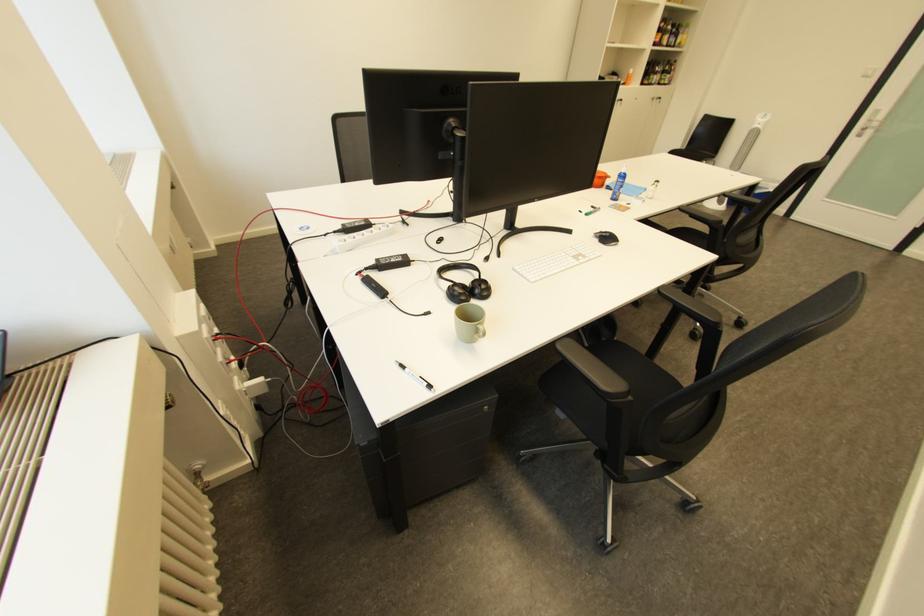
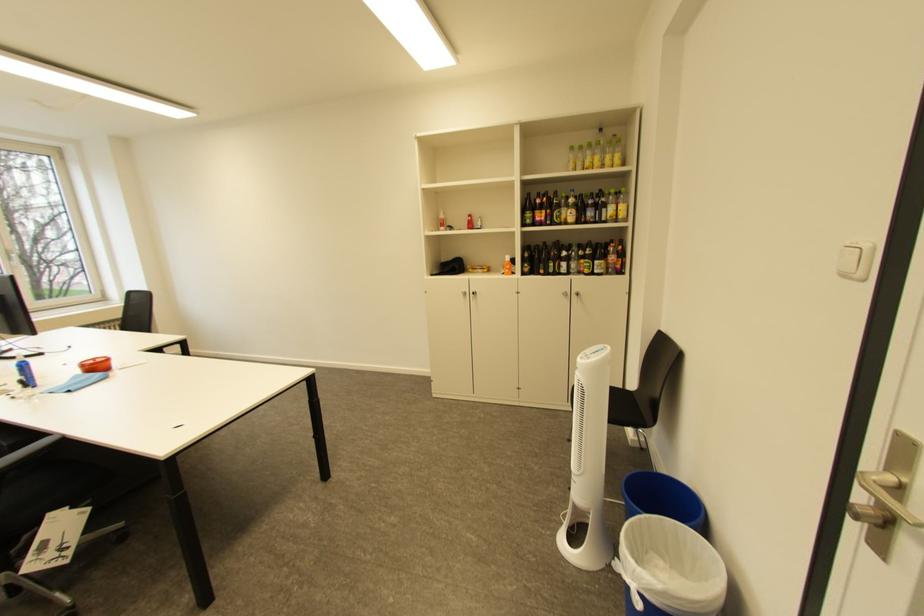
The point at (686, 34) is marked in the first image. Where is the corresponding point in the second image?

(610, 208)